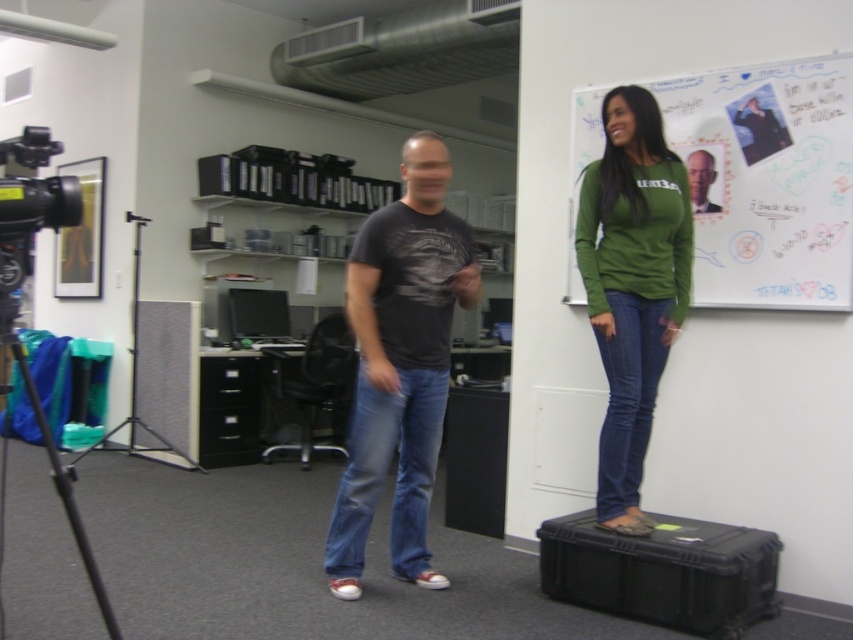
From the picture: You are standing at the center of the office and want to reach the green matte whiteboard at upper right. Which direction should you move to face the whiteboard?

The green matte whiteboard at upper right is located at point 0.283 on the x axis and 0.903 on the y axis, so you should move to the left and upwards to face it.

Based on the photo, you are standing in an office and see a point at coordinates (769,180). What object is located at that point?

The point at coordinates (769,180) corresponds to the green matte whiteboard at upper right.